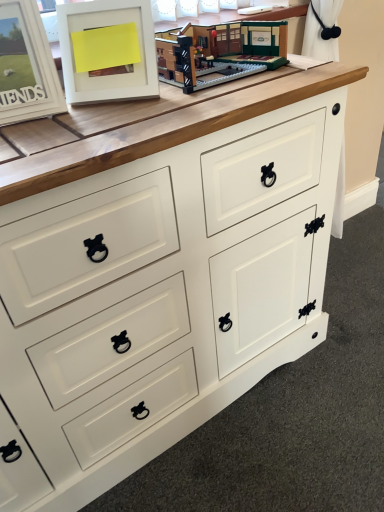
Question: Does brick-like lego set at upper center have a greater width compared to white matte picture frame at upper left, the second picture frame positioned from the left?

Choices:
 (A) no
 (B) yes

Answer: (B)

Question: Is brick-like lego set at upper center shorter than white matte picture frame at upper left, the second picture frame positioned from the left?

Choices:
 (A) yes
 (B) no

Answer: (A)

Question: Is brick-like lego set at upper center behind white matte picture frame at upper left, the second picture frame positioned from the left?

Choices:
 (A) yes
 (B) no

Answer: (A)

Question: Is brick-like lego set at upper center bigger than white matte picture frame at upper left, the second picture frame positioned from the left?

Choices:
 (A) no
 (B) yes

Answer: (A)

Question: From a real-world perspective, is brick-like lego set at upper center located higher than white matte picture frame at upper left, which is counted as the 1th picture frame, starting from the right?

Choices:
 (A) no
 (B) yes

Answer: (A)

Question: From a real-world perspective, is brick-like lego set at upper center located beneath white matte picture frame at upper left, which is counted as the 1th picture frame, starting from the right?

Choices:
 (A) no
 (B) yes

Answer: (B)

Question: Can you confirm if white matte picture frame at upper left, which is the second picture frame in right-to-left order, is thinner than brick-like lego set at upper center?

Choices:
 (A) yes
 (B) no

Answer: (A)

Question: Is white matte picture frame at upper left, which is the second picture frame in right-to-left order, wider than brick-like lego set at upper center?

Choices:
 (A) no
 (B) yes

Answer: (A)

Question: Are white matte picture frame at upper left, which is the second picture frame in right-to-left order, and brick-like lego set at upper center making contact?

Choices:
 (A) no
 (B) yes

Answer: (A)

Question: Is white matte picture frame at upper left, the first picture frame from the left, not close to brick-like lego set at upper center?

Choices:
 (A) yes
 (B) no

Answer: (B)

Question: Considering the relative sizes of white matte picture frame at upper left, which is the second picture frame in right-to-left order, and brick-like lego set at upper center in the image provided, is white matte picture frame at upper left, which is the second picture frame in right-to-left order, shorter than brick-like lego set at upper center?

Choices:
 (A) no
 (B) yes

Answer: (A)

Question: Can you confirm if white matte picture frame at upper left, the first picture frame from the left, is taller than brick-like lego set at upper center?

Choices:
 (A) no
 (B) yes

Answer: (B)

Question: Is brick-like lego set at upper center in contact with white matte picture frame at upper left, the first picture frame from the left?

Choices:
 (A) yes
 (B) no

Answer: (B)